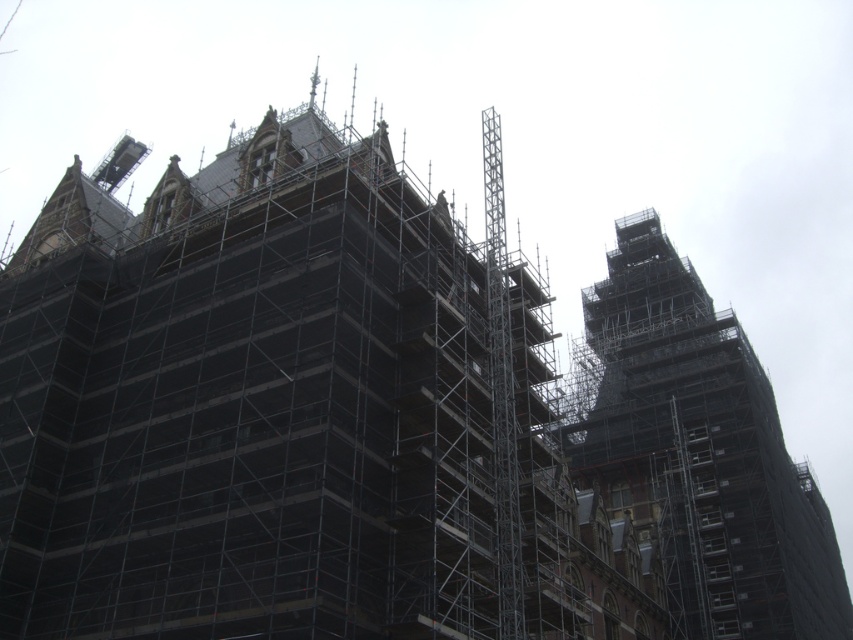
Does metal scaffolding at center appear on the left side of black scaffolding at center?

Yes, metal scaffolding at center is to the left of black scaffolding at center.

Is metal scaffolding at center further to the viewer compared to black scaffolding at center?

No.

You are a GUI agent. You are given a task and a screenshot of the screen. Output one action in this format:
    pyautogui.click(x=<x>, y=<y>)
    Task: Click on the metal scaffolding at center
    The height and width of the screenshot is (640, 853).
    Given the screenshot: What is the action you would take?
    pyautogui.click(x=277, y=406)